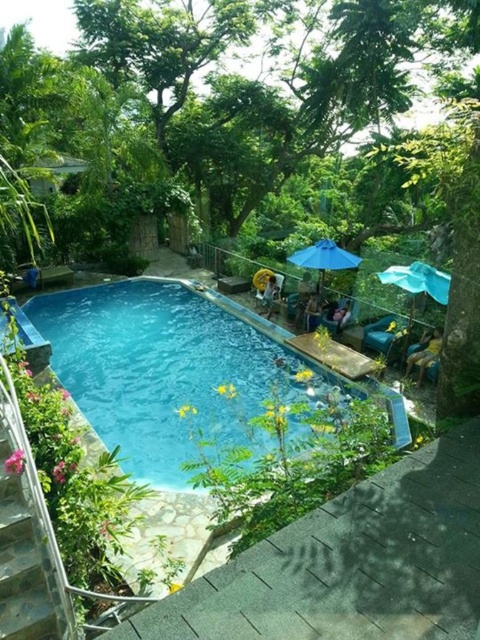
Question: Which point is closer to the camera?

Choices:
 (A) blue fabric umbrella at center
 (B) blue fabric umbrella at upper right

Answer: (B)

Question: Based on their relative distances, which object is nearer to the blue fabric umbrella at center?

Choices:
 (A) blue fabric umbrella at upper right
 (B) blue concrete pool at center

Answer: (A)

Question: Is the position of blue concrete pool at center less distant than that of blue fabric umbrella at center?

Choices:
 (A) no
 (B) yes

Answer: (B)

Question: Can you confirm if blue concrete pool at center is smaller than blue fabric umbrella at upper right?

Choices:
 (A) yes
 (B) no

Answer: (B)

Question: Among these objects, which one is farthest from the camera?

Choices:
 (A) blue fabric umbrella at upper right
 (B) blue concrete pool at center

Answer: (A)

Question: Is blue concrete pool at center behind blue fabric umbrella at center?

Choices:
 (A) no
 (B) yes

Answer: (A)